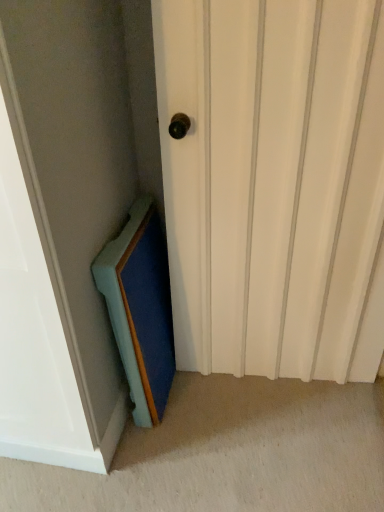
Question: Can you confirm if teal wood medicine cabinet at lower left is positioned to the right of white matte door at center?

Choices:
 (A) no
 (B) yes

Answer: (A)

Question: From a real-world perspective, is teal wood medicine cabinet at lower left positioned over white matte door at center based on gravity?

Choices:
 (A) no
 (B) yes

Answer: (A)

Question: Considering the relative positions of teal wood medicine cabinet at lower left and white matte door at center in the image provided, is teal wood medicine cabinet at lower left to the left of white matte door at center from the viewer's perspective?

Choices:
 (A) yes
 (B) no

Answer: (A)

Question: Is white matte door at center surrounded by teal wood medicine cabinet at lower left?

Choices:
 (A) yes
 (B) no

Answer: (B)

Question: Is teal wood medicine cabinet at lower left behind white matte door at center?

Choices:
 (A) no
 (B) yes

Answer: (B)

Question: From the image's perspective, would you say teal wood medicine cabinet at lower left is shown under white matte door at center?

Choices:
 (A) no
 (B) yes

Answer: (B)

Question: Does white matte door at center have a greater height compared to teal wood medicine cabinet at lower left?

Choices:
 (A) yes
 (B) no

Answer: (A)

Question: From the image's perspective, is white matte door at center below teal wood medicine cabinet at lower left?

Choices:
 (A) yes
 (B) no

Answer: (B)

Question: Considering the relative sizes of white matte door at center and teal wood medicine cabinet at lower left in the image provided, is white matte door at center bigger than teal wood medicine cabinet at lower left?

Choices:
 (A) no
 (B) yes

Answer: (B)

Question: Is the depth of white matte door at center less than that of teal wood medicine cabinet at lower left?

Choices:
 (A) yes
 (B) no

Answer: (A)

Question: Is white matte door at center touching teal wood medicine cabinet at lower left?

Choices:
 (A) no
 (B) yes

Answer: (A)

Question: Considering the relative sizes of white matte door at center and teal wood medicine cabinet at lower left in the image provided, is white matte door at center wider than teal wood medicine cabinet at lower left?

Choices:
 (A) yes
 (B) no

Answer: (A)

Question: Do you think white matte door at center is within teal wood medicine cabinet at lower left, or outside of it?

Choices:
 (A) outside
 (B) inside

Answer: (A)